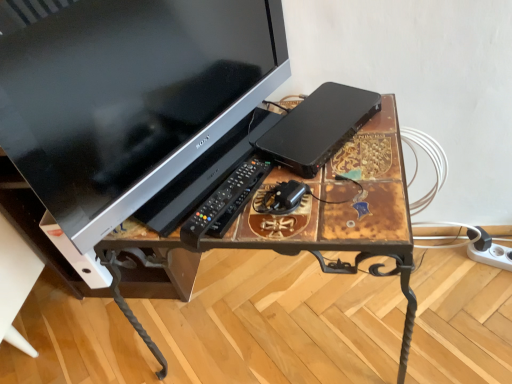
What are the coordinates of `free space to the left of black plastic remote at center` in the screenshot? It's located at (153, 222).